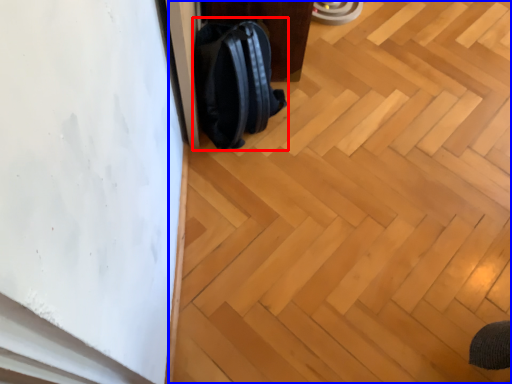
Question: Which point is further to the camera, backpack (highlighted by a red box) or plywood (highlighted by a blue box)?

Choices:
 (A) backpack
 (B) plywood

Answer: (A)